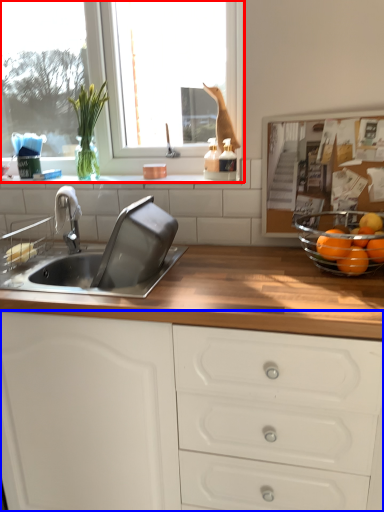
Question: Which object is further to the camera taking this photo, window (highlighted by a red box) or cabinetry (highlighted by a blue box)?

Choices:
 (A) window
 (B) cabinetry

Answer: (A)